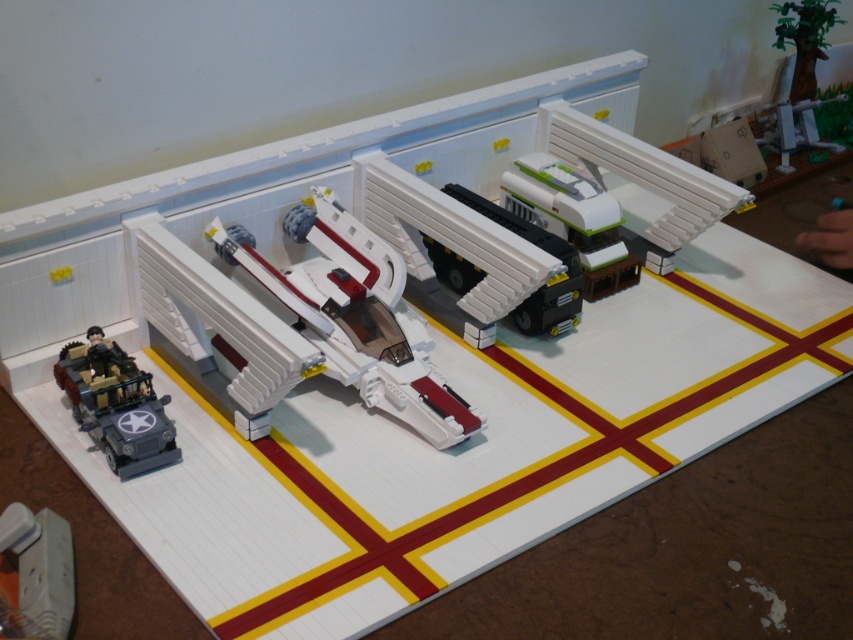
Between point (315, 323) and point (22, 608), which one is positioned in front?

Point (22, 608) is more forward.

You are a GUI agent. You are given a task and a screenshot of the screen. Output one action in this format:
    pyautogui.click(x=<x>, y=<y>)
    Task: Click on the white plastic spaceship at center
    
    Given the screenshot: What is the action you would take?
    pyautogui.click(x=355, y=316)

Who is positioned more to the left, white plastic truck at center or white plastic plug at lower left?

white plastic plug at lower left

Can you confirm if white plastic truck at center is positioned above white plastic plug at lower left?

Correct, white plastic truck at center is located above white plastic plug at lower left.

Locate an element on the screen. The image size is (853, 640). white plastic truck at center is located at coordinates (448, 248).

Does matte gray military jeep at lower left appear on the left side of white plastic plug at lower left?

No, matte gray military jeep at lower left is not to the left of white plastic plug at lower left.

Between matte gray military jeep at lower left and white plastic plug at lower left, which one appears on the right side from the viewer's perspective?

Positioned to the right is matte gray military jeep at lower left.

Is point (96, 346) positioned behind point (48, 628)?

Yes, it is.

You are a GUI agent. You are given a task and a screenshot of the screen. Output one action in this format:
    pyautogui.click(x=<x>, y=<y>)
    Task: Click on the matte gray military jeep at lower left
    
    Given the screenshot: What is the action you would take?
    pyautogui.click(x=115, y=404)